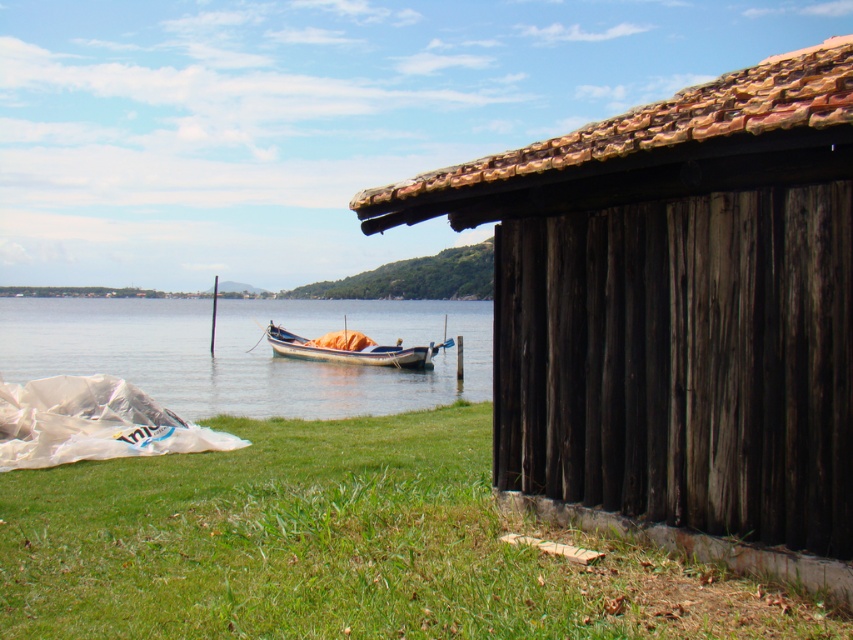
Question: Estimate the real-world distances between objects in this image. Which object is closer to the wooden boat at center?

Choices:
 (A) green grass at lower center
 (B) dark brown wooden hut at right
 (C) clear water at boat left

Answer: (C)

Question: Which point is closer to the camera?

Choices:
 (A) (555, 177)
 (B) (392, 362)
 (C) (189, 314)
 (D) (403, 449)

Answer: (A)

Question: Observing the image, what is the correct spatial positioning of green grass at lower center in reference to clear water at boat left?

Choices:
 (A) right
 (B) left

Answer: (A)

Question: Considering the relative positions of dark brown wooden hut at right and green grass at lower center in the image provided, where is dark brown wooden hut at right located with respect to green grass at lower center?

Choices:
 (A) left
 (B) right

Answer: (B)

Question: In this image, where is dark brown wooden hut at right located relative to green grass at lower center?

Choices:
 (A) right
 (B) left

Answer: (A)

Question: Which point is farther to the camera?

Choices:
 (A) (456, 381)
 (B) (688, 115)
 (C) (415, 348)
 (D) (399, 452)

Answer: (A)